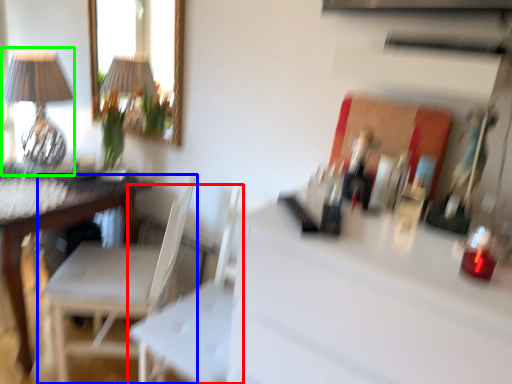
Question: Estimate the real-world distances between objects in this image. Which object is closer to swivel chair (highlighted by a red box), chair (highlighted by a blue box) or table lamp (highlighted by a green box)?

Choices:
 (A) chair
 (B) table lamp

Answer: (A)